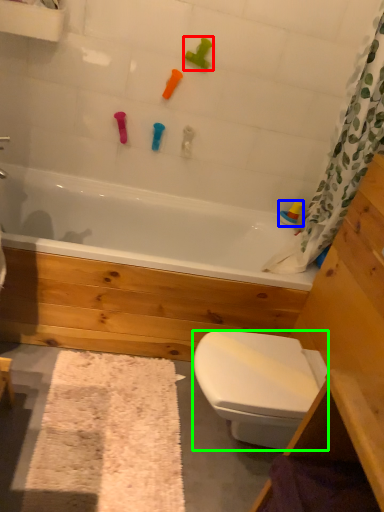
Question: Considering the real-world distances, which object is farthest from toy (highlighted by a red box)? toy (highlighted by a blue box) or bidet (highlighted by a green box)?

Choices:
 (A) toy
 (B) bidet

Answer: (B)